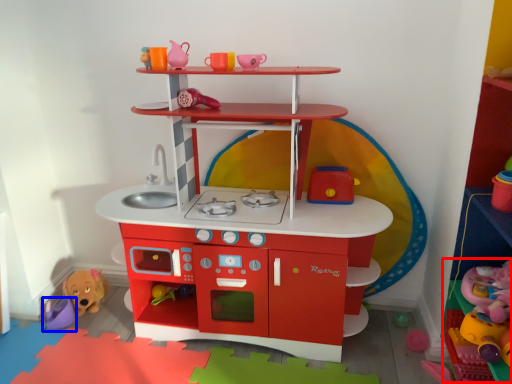
Question: Which object appears farthest to the camera in this image, toy (highlighted by a red box) or toy (highlighted by a blue box)?

Choices:
 (A) toy
 (B) toy

Answer: (B)